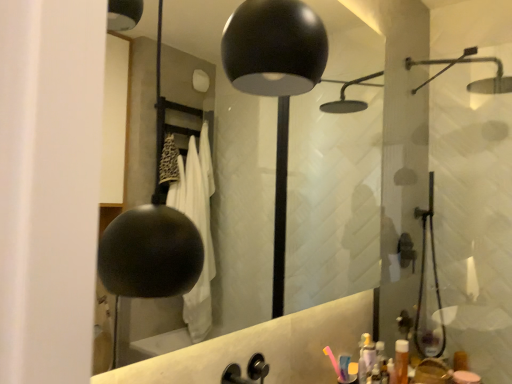
Question: Is pink plastic toothbrush at lower right to the left of black matte mirror at upper center from the viewer's perspective?

Choices:
 (A) yes
 (B) no

Answer: (B)

Question: Considering the relative sizes of pink plastic toothbrush at lower right and black matte mirror at upper center in the image provided, is pink plastic toothbrush at lower right wider than black matte mirror at upper center?

Choices:
 (A) yes
 (B) no

Answer: (B)

Question: Can you confirm if pink plastic toothbrush at lower right is shorter than black matte mirror at upper center?

Choices:
 (A) no
 (B) yes

Answer: (B)

Question: Considering the relative positions of pink plastic toothbrush at lower right and black matte mirror at upper center in the image provided, is pink plastic toothbrush at lower right to the right of black matte mirror at upper center from the viewer's perspective?

Choices:
 (A) yes
 (B) no

Answer: (A)

Question: Is pink plastic toothbrush at lower right bigger than black matte mirror at upper center?

Choices:
 (A) no
 (B) yes

Answer: (A)

Question: Would you say pink plastic toothbrush at lower right contains black matte mirror at upper center?

Choices:
 (A) yes
 (B) no

Answer: (B)

Question: Is black matte faucet at center at the right side of translucent orange bottle at lower right?

Choices:
 (A) yes
 (B) no

Answer: (B)

Question: Does black matte faucet at center have a greater height compared to translucent orange bottle at lower right?

Choices:
 (A) yes
 (B) no

Answer: (B)

Question: Does black matte faucet at center come in front of translucent orange bottle at lower right?

Choices:
 (A) yes
 (B) no

Answer: (A)

Question: From a real-world perspective, does black matte faucet at center sit lower than translucent orange bottle at lower right?

Choices:
 (A) yes
 (B) no

Answer: (B)

Question: From the image's perspective, would you say black matte faucet at center is positioned over translucent orange bottle at lower right?

Choices:
 (A) no
 (B) yes

Answer: (B)

Question: Is black matte faucet at center shorter than translucent orange bottle at lower right?

Choices:
 (A) yes
 (B) no

Answer: (A)

Question: Does black matte faucet at center appear on the right side of pink plastic toothbrush at lower right?

Choices:
 (A) yes
 (B) no

Answer: (B)